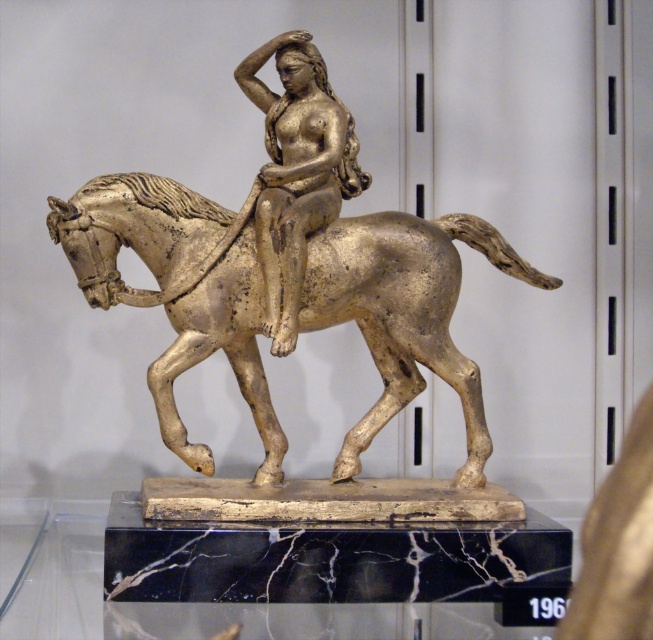
You are an art conservator examining the classical bronze sculpture. You notice two points on the statue that require restoration. One is located at point (133, 301) and the other at point (349, 179). Which of these points is closer to you as you stand in front of the sculpture?

Point (133, 301) is closer to the viewer than point (349, 179).

You are an art conservator examining the classical bronze sculpture. You notice the gold polished horse at center and the gold metallic figure at center. Based on their positions, which object is located to the left?

The gold polished horse at center is positioned on the left side of the gold metallic figure at center, so it is located to the left.